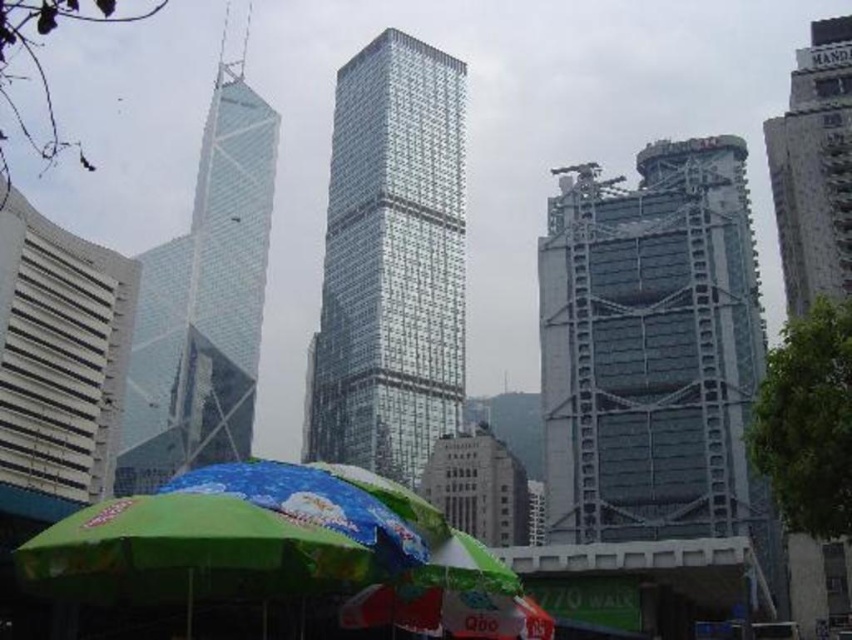
Question: Can you confirm if transparent glass skyscraper at left is smaller than white glass building at upper right?

Choices:
 (A) yes
 (B) no

Answer: (B)

Question: Does reflective glass skyscraper at center appear on the left side of transparent glass skyscraper at left?

Choices:
 (A) no
 (B) yes

Answer: (A)

Question: Can you confirm if metallic scaffolding at right is positioned to the right of reflective glass skyscraper at center?

Choices:
 (A) no
 (B) yes

Answer: (B)

Question: Among these points, which one is farthest from the camera?

Choices:
 (A) (675, 282)
 (B) (392, 67)

Answer: (B)

Question: Which of the following is the farthest from the observer?

Choices:
 (A) (163, 349)
 (B) (774, 164)
 (C) (338, 115)

Answer: (C)

Question: Estimate the real-world distances between objects in this image. Which object is farther from the white glass building at upper right?

Choices:
 (A) metallic scaffolding at right
 (B) transparent glass skyscraper at left

Answer: (B)